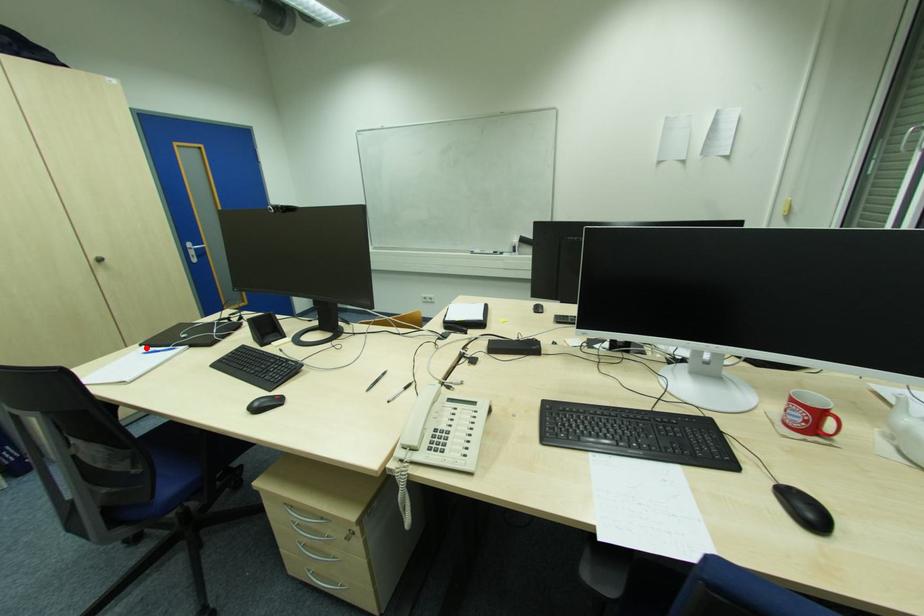
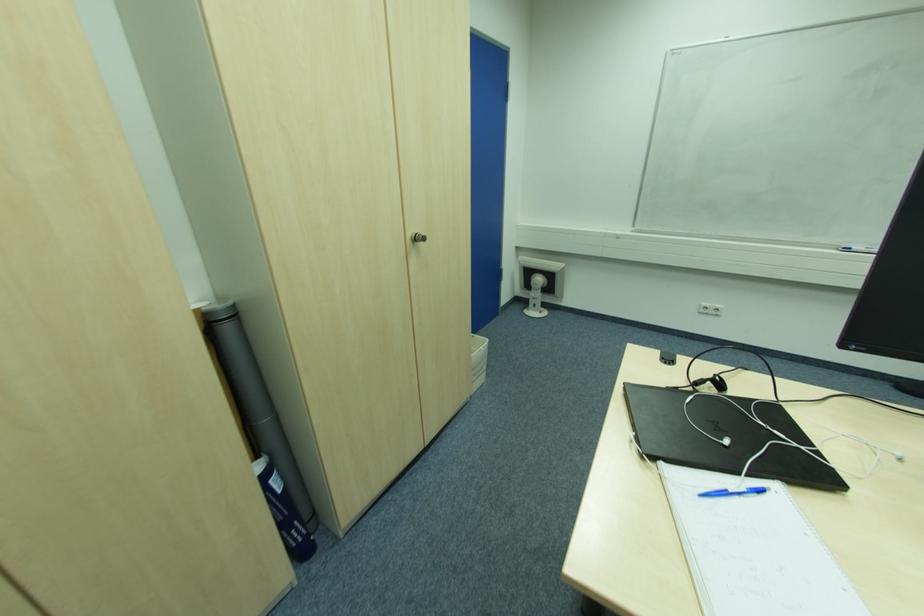
In the second image, find the point that corresponds to the highlighted location in the first image.

(663, 464)